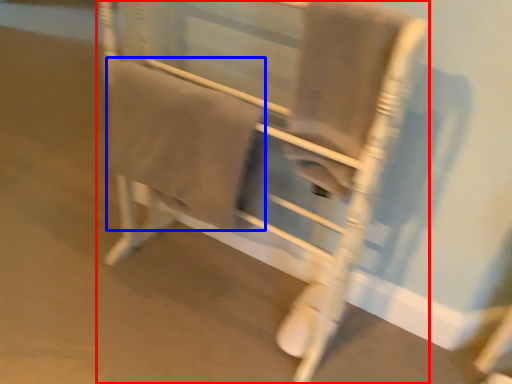
Question: Which object appears closest to the camera in this image, furniture (highlighted by a red box) or bath towel (highlighted by a blue box)?

Choices:
 (A) furniture
 (B) bath towel

Answer: (A)